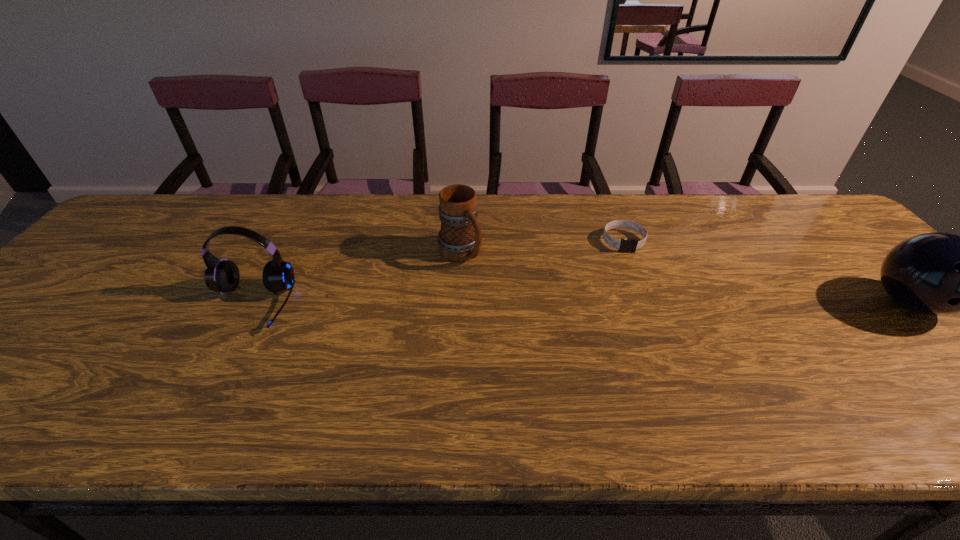
The height and width of the screenshot is (540, 960). Identify the location of free space located on the outer surface of the shortest object. (645, 305).

The width and height of the screenshot is (960, 540). Identify the location of mug that is at the far edge. (460, 238).

I want to click on wristband that is at the far edge, so click(x=625, y=245).

This screenshot has width=960, height=540. I want to click on free region at the far edge, so click(787, 237).

Identify the location of blank space at the near edge. (403, 365).

This screenshot has height=540, width=960. In the image, there is a desktop. What are the coordinates of `vacant space at the left edge` in the screenshot? It's located at (106, 278).

Where is `free region at the right edge`? The width and height of the screenshot is (960, 540). free region at the right edge is located at coordinates (828, 255).

Locate an element on the screen. free space between the headset and the third object from left to right is located at coordinates (437, 273).

This screenshot has height=540, width=960. I want to click on vacant area that lies between the headset and the third object from right to left, so click(355, 279).

Find the location of a particular element. vacant space in between the leftmost object and the wristband is located at coordinates (437, 273).